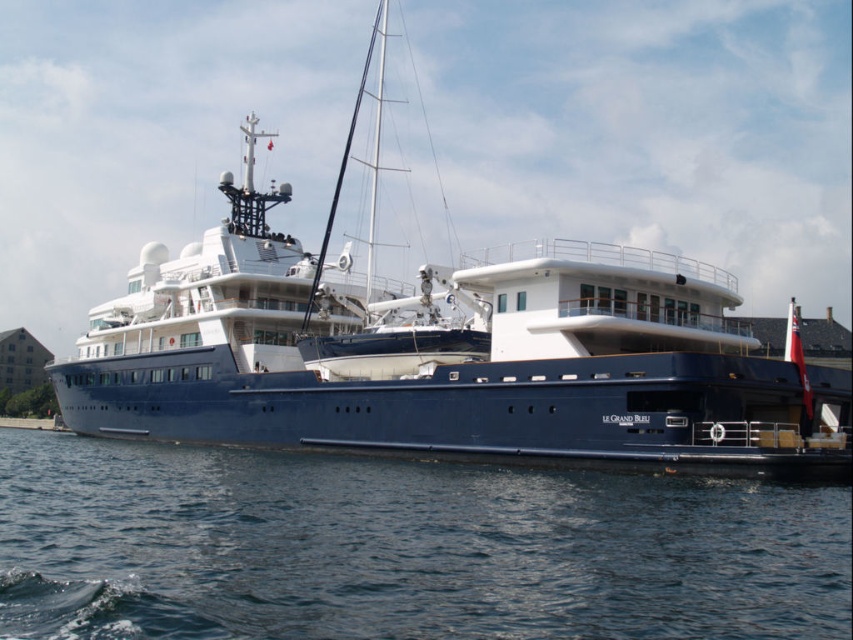
Question: Which of the following is the closest to the observer?

Choices:
 (A) (537, 396)
 (B) (845, 520)

Answer: (B)

Question: Which object appears farthest from the camera in this image?

Choices:
 (A) blue water at lower center
 (B) blue polished yacht at center

Answer: (B)

Question: Can you confirm if blue polished yacht at center is positioned to the right of blue water at lower center?

Choices:
 (A) yes
 (B) no

Answer: (A)

Question: Is blue polished yacht at center above blue water at lower center?

Choices:
 (A) yes
 (B) no

Answer: (A)

Question: Among these objects, which one is nearest to the camera?

Choices:
 (A) blue polished yacht at center
 (B) blue water at lower center

Answer: (B)

Question: Does blue polished yacht at center have a lesser width compared to blue water at lower center?

Choices:
 (A) no
 (B) yes

Answer: (A)